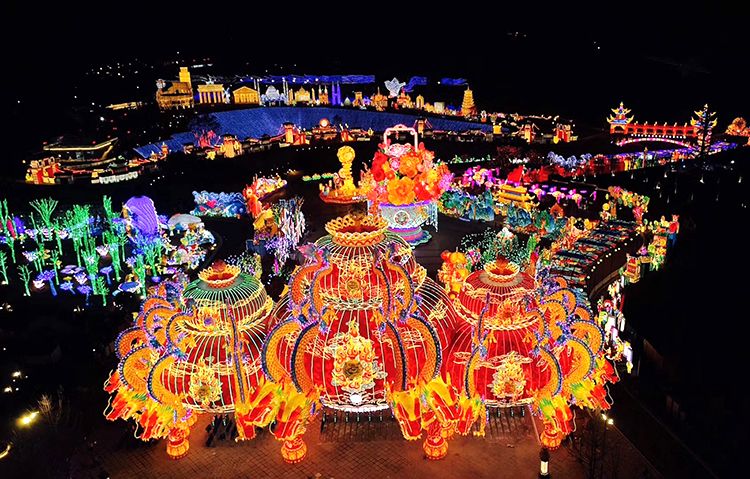
This screenshot has width=750, height=479. Identify the location of pruple lights. (157, 218).